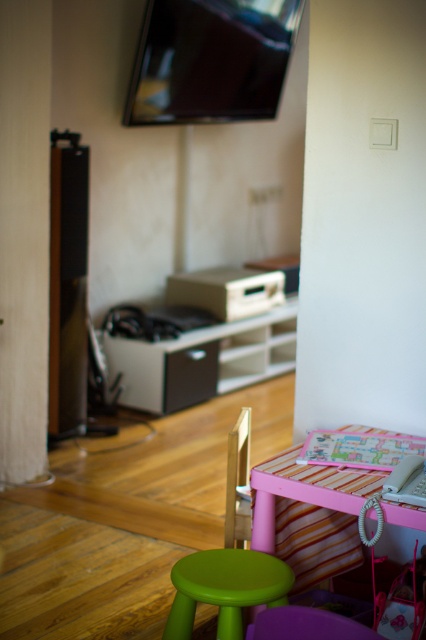
You are a guest entering the room and want to sit down. You see the white matte entertainment center at center and the purple plastic chair at lower center. Which object should you approach to sit?

The purple plastic chair at lower center is behind the white matte entertainment center at center, so you should approach the purple plastic chair at lower center to sit.

You are arranging furniture in the living room and need to place the white matte entertainment center at center and the purple plastic chair at lower center. According to the scene description, which object is located to the left of the other?

The white matte entertainment center at center is positioned on the left side of purple plastic chair at lower center, so the entertainment center is to the left of the chair.

You are standing in the living room and want to place a large painting that is 4 meters wide on the wall behind the white matte entertainment center at center. Can the painting fit horizontally if the wall is 5 meters wide?

The white matte entertainment center at center is 4.45 meters from the camera, but this distance does not directly indicate the width of the wall. However, since the wall is 5 meters wide and the painting is 4 meters wide, the painting can fit horizontally as 4 meters is less than 5 meters.